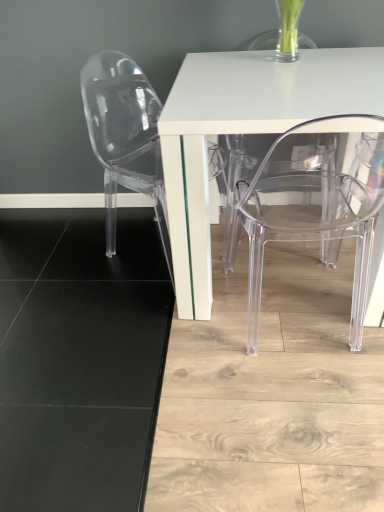
Question: From a real-world perspective, is transparent acrylic chair at lower right, the first chair when ordered from right to left, physically above transparent plastic chair at left, the first chair from the left?

Choices:
 (A) no
 (B) yes

Answer: (B)

Question: From the image's perspective, does transparent acrylic chair at lower right, which is the 2th chair in left-to-right order, appear higher than transparent plastic chair at left, the first chair from the left?

Choices:
 (A) yes
 (B) no

Answer: (B)

Question: Is transparent acrylic chair at lower right, the first chair when ordered from right to left, to the right of transparent plastic chair at left, the first chair from the left, from the viewer's perspective?

Choices:
 (A) no
 (B) yes

Answer: (B)

Question: From a real-world perspective, is transparent acrylic chair at lower right, which is the 2th chair in left-to-right order, under transparent plastic chair at left, arranged as the second chair when viewed from the right?

Choices:
 (A) yes
 (B) no

Answer: (B)

Question: Is transparent acrylic chair at lower right, which is the 2th chair in left-to-right order, bigger than transparent plastic chair at left, arranged as the second chair when viewed from the right?

Choices:
 (A) yes
 (B) no

Answer: (B)

Question: From a real-world perspective, is white glossy table at center physically located above or below transparent plastic chair at left, arranged as the second chair when viewed from the right?

Choices:
 (A) below
 (B) above

Answer: (A)

Question: Is white glossy table at center spatially inside transparent plastic chair at left, the first chair from the left, or outside of it?

Choices:
 (A) outside
 (B) inside

Answer: (A)

Question: Is point (223, 108) positioned closer to the camera than point (142, 186)?

Choices:
 (A) closer
 (B) farther

Answer: (A)

Question: Visually, is white glossy table at center positioned to the left or to the right of transparent plastic chair at left, arranged as the second chair when viewed from the right?

Choices:
 (A) left
 (B) right

Answer: (B)

Question: In terms of height, does transparent acrylic chair at lower right, the first chair when ordered from right to left, look taller or shorter compared to white glossy table at center?

Choices:
 (A) short
 (B) tall

Answer: (B)

Question: Is transparent acrylic chair at lower right, which is the 2th chair in left-to-right order, bigger or smaller than white glossy table at center?

Choices:
 (A) small
 (B) big

Answer: (A)

Question: From the image's perspective, is transparent acrylic chair at lower right, the first chair when ordered from right to left, positioned above or below white glossy table at center?

Choices:
 (A) above
 (B) below

Answer: (B)

Question: Is transparent acrylic chair at lower right, the first chair when ordered from right to left, to the left or to the right of white glossy table at center in the image?

Choices:
 (A) right
 (B) left

Answer: (B)

Question: Considering the positions of transparent plastic chair at left, the first chair from the left, and transparent acrylic chair at lower right, the first chair when ordered from right to left, in the image, is transparent plastic chair at left, the first chair from the left, bigger or smaller than transparent acrylic chair at lower right, the first chair when ordered from right to left,?

Choices:
 (A) big
 (B) small

Answer: (A)

Question: Is transparent plastic chair at left, arranged as the second chair when viewed from the right, in front of or behind transparent acrylic chair at lower right, the first chair when ordered from right to left, in the image?

Choices:
 (A) front
 (B) behind

Answer: (B)